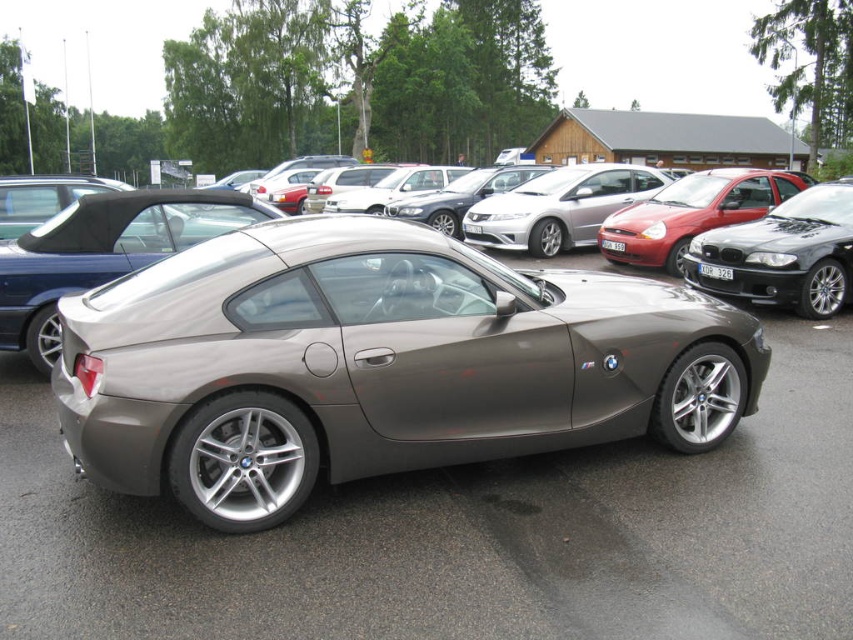
You are a parking attendant and need to fit both the metallic gray car at center and the satin black sedan at center into a parking space that can only accommodate one vehicle. Which vehicle should you choose to park first to ensure it fits?

The metallic gray car at center is smaller than the satin black sedan at center, so you should park the metallic gray car at center first to ensure it fits in the space.

In the scene shown: You are standing in a parking lot and want to measure the distance to the metallic gray car at center. If your measuring tape can extend up to 10 feet, will it be sufficient to measure the distance?

The distance between you and the metallic gray car at center is 9.72 feet, which is within the 10 feet limit of your measuring tape. Therefore, the tape is sufficient.

You are a parking attendant and need to guide a driver to park their car between the metallic gray car at center and the satin black sedan at center. Based on their positions, which car should the driver park closer to?

The metallic gray car at center is located below the satin black sedan at center. Since the driver needs to park between them, they should position their car closer to the metallic gray car at center as it is lower in the parking spot.